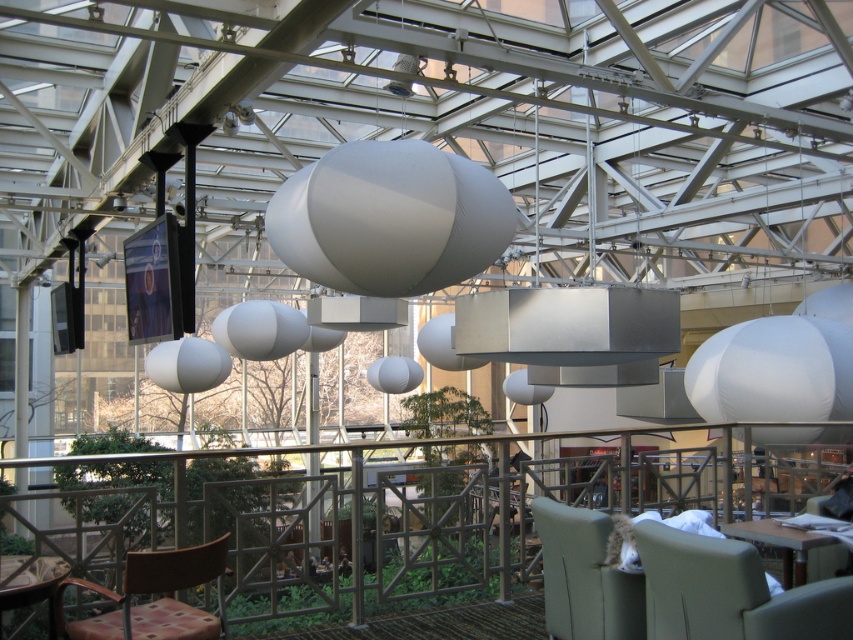
Question: Which of the following is the farthest from the observer?

Choices:
 (A) plaid fabric armchair at lower left
 (B) matte white table at lower right
 (C) gray fabric armchair at lower right

Answer: (B)

Question: Is gray fabric chair at lower right thinner than plaid fabric armchair at lower left?

Choices:
 (A) yes
 (B) no

Answer: (A)

Question: Does gray fabric armchair at lower right have a smaller size compared to plaid fabric armchair at lower left?

Choices:
 (A) no
 (B) yes

Answer: (B)

Question: Estimate the real-world distances between objects in this image. Which object is farther from the gray fabric armchair at lower right?

Choices:
 (A) plaid fabric armchair at lower left
 (B) matte white table at lower right

Answer: (A)

Question: Can you confirm if gray fabric armchair at lower right is positioned to the right of plaid fabric armchair at lower left?

Choices:
 (A) yes
 (B) no

Answer: (A)

Question: Which of the following is the closest to the observer?

Choices:
 (A) (639, 573)
 (B) (53, 612)
 (C) (773, 528)

Answer: (B)